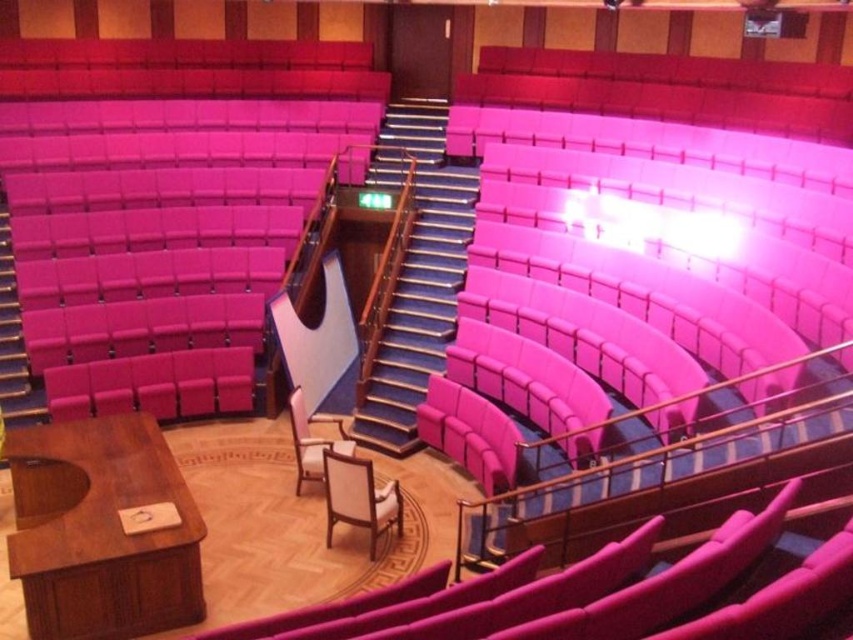
You are sitting in the auditorium and want to move to the stage. You see the white fabric chair at center and the pink fabric chair at center. Which chair is closer to you?

The white fabric chair at center is closer to you than the pink fabric chair at center.

You are sitting in the auditorium and want to move to the white fabric chair at center. Based on the 2D coordinates provided, can you determine if the chair is closer to the stage or the back of the auditorium?

The 2D location of the white fabric chair at center is at point (358, 497). Since the x and y coordinates are both above 0.5, this suggests the chair is closer to the back of the auditorium rather than the stage.

You are attending a lecture in the auditorium and need to sit down. You see both the white fabric chair at center and the pink fabric chair at center. Which chair is located directly above the other?

The white fabric chair at center is positioned under the pink fabric chair at center, so the pink fabric chair at center is directly above the white fabric chair at center.